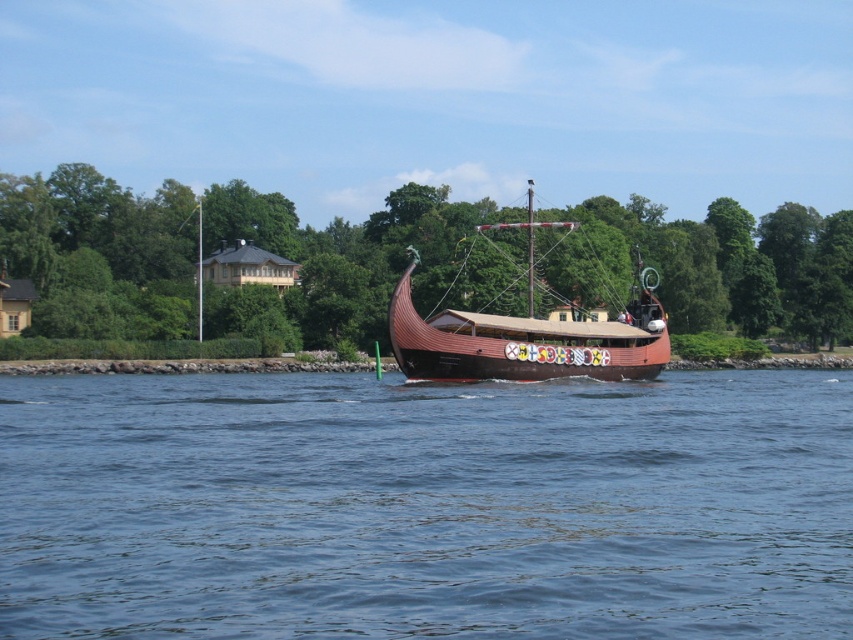
You are standing on the dock and see the blue water at center and the brown wooden pirate ship at center. If you want to throw a lifebuoy to someone in the water, which direction should you aim? Please consider the distance between the objects.

The blue water at center is 20.72 meters away from the brown wooden pirate ship at center. Since the ship is at the center and the water is also at the center, you should aim directly towards the center where the blue water at center is located to reach the person in the water.

You are standing on the deck of the Viking ship and want to determine which of the two points, point (695, 529) or point (643, 358), is closer to you. Based on the scene, which point is nearer?

Point (695, 529) is closer to the viewer than point (643, 358).

You are an observer standing on the shore looking at the blue water at center and the brown wooden pirate ship at center. Which object appears larger in the scene?

The brown wooden pirate ship at center appears larger than the blue water at center because the blue water at center is smaller than brown wooden pirate ship at center.